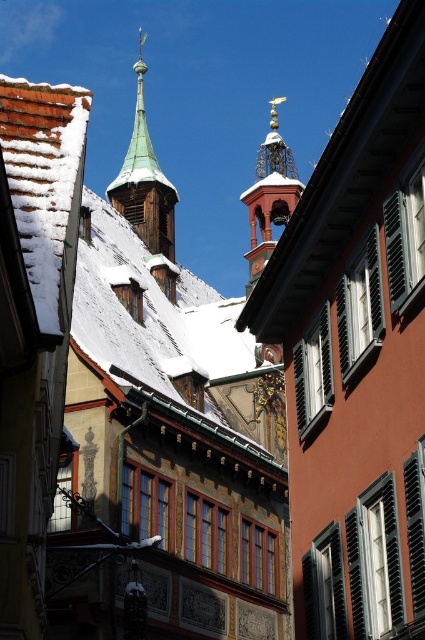
In the scene shown: You are standing at the point with coordinates (144, 182) in the historic European town scene. What architectural feature are you currently positioned at?

The point at coordinates (144, 182) corresponds to the green copper spire at upper left.

You are an architect evaluating the structural integrity of the buildings in the historic town. You notice the green copper spire at upper left and the polished brass bell tower at center. Which one is located to the left of the other?

The green copper spire at upper left is positioned on the left side of the polished brass bell tower at center.